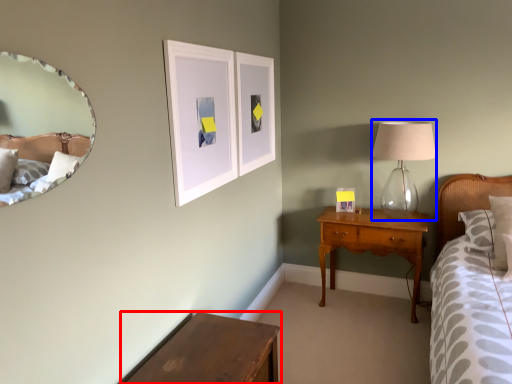
Question: Which object is closer to the camera taking this photo, table (highlighted by a red box) or table lamp (highlighted by a blue box)?

Choices:
 (A) table
 (B) table lamp

Answer: (A)